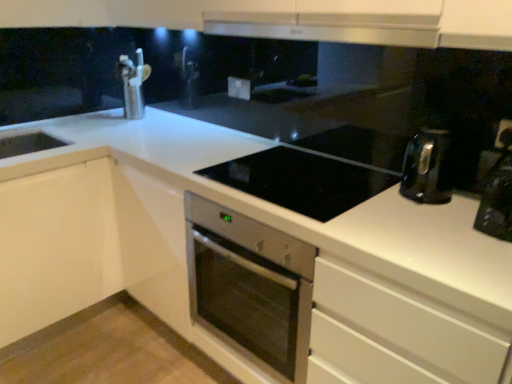
This screenshot has height=384, width=512. I want to click on unoccupied region to the right of brushed metal faucet at upper left, so click(167, 115).